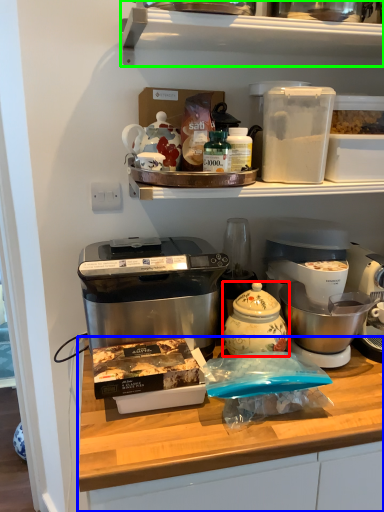
Question: Which is nearer to the kitchen appliance (highlighted by a red box)? table (highlighted by a blue box) or shelf (highlighted by a green box).

Choices:
 (A) table
 (B) shelf

Answer: (A)